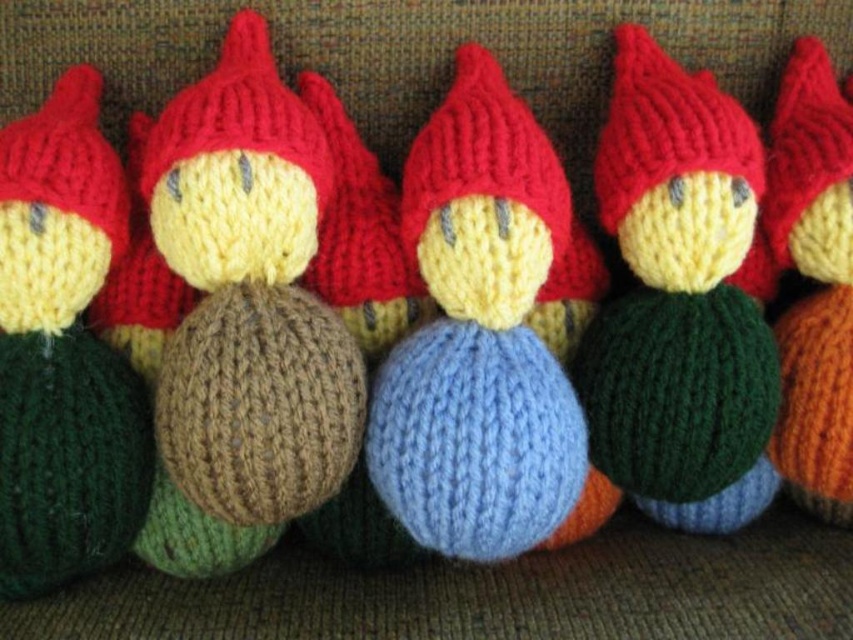
Which is behind, point (473, 269) or point (614, 365)?

The point (614, 365) is more distant.

Who is taller, blue knitted ball at center or green knitted ball at center?

green knitted ball at center is taller.

Measure the distance between blue knitted ball at center and camera.

blue knitted ball at center is 36.89 inches from camera.

At what (x,y) coordinates should I click in order to perform the action: click on blue knitted ball at center. Please return your answer as a coordinate pair (x, y). Looking at the image, I should click on (482, 340).

Does green knitted ball at left have a larger size compared to orange knitted ball at center?

Yes, green knitted ball at left is bigger than orange knitted ball at center.

Is green knitted ball at left to the left of orange knitted ball at center from the viewer's perspective?

Indeed, green knitted ball at left is positioned on the left side of orange knitted ball at center.

Who is more distant from viewer, (25, 272) or (827, 138)?

Point (827, 138)

At what (x,y) coordinates should I click in order to perform the action: click on green knitted ball at left. Please return your answer as a coordinate pair (x, y). This screenshot has width=853, height=640. Looking at the image, I should click on (62, 349).

Can you confirm if blue knitted ball at center is bigger than orange knitted ball at center?

Yes.

Is point (471, 282) positioned behind point (785, 266)?

No, it is in front of (785, 266).

Image resolution: width=853 pixels, height=640 pixels. In order to click on blue knitted ball at center in this screenshot , I will do `click(482, 340)`.